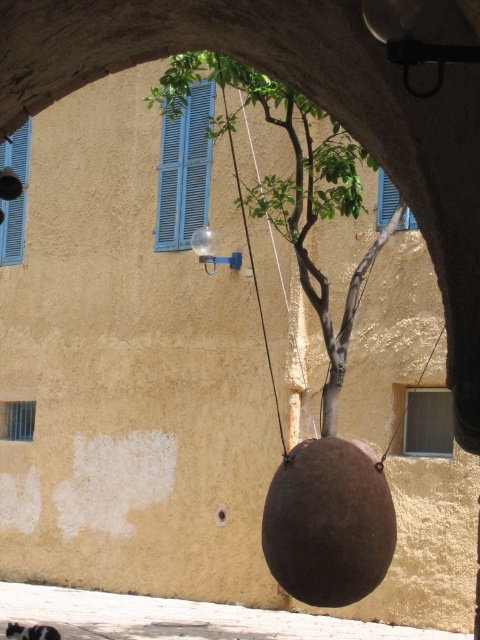
Question: Which point appears closest to the camera in this image?

Choices:
 (A) pyautogui.click(x=398, y=195)
 (B) pyautogui.click(x=10, y=163)
 (C) pyautogui.click(x=60, y=620)

Answer: (C)

Question: Is brown matte tree at center to the right of blue wooden shutter at upper center from the viewer's perspective?

Choices:
 (A) no
 (B) yes

Answer: (A)

Question: Is brown matte tree at center bigger than blue wooden shutters at upper left?

Choices:
 (A) yes
 (B) no

Answer: (A)

Question: Which is nearer to the brown matte pot at lower center?

Choices:
 (A) blue painted wood shutter at upper left
 (B) blue wooden shutters at upper left

Answer: (A)

Question: Which point appears farthest from the camera in this image?

Choices:
 (A) (418, 417)
 (B) (23, 193)
 (C) (8, 596)

Answer: (B)

Question: Does brown matte pot at lower center have a greater width compared to blue wooden shutters at upper left?

Choices:
 (A) no
 (B) yes

Answer: (B)